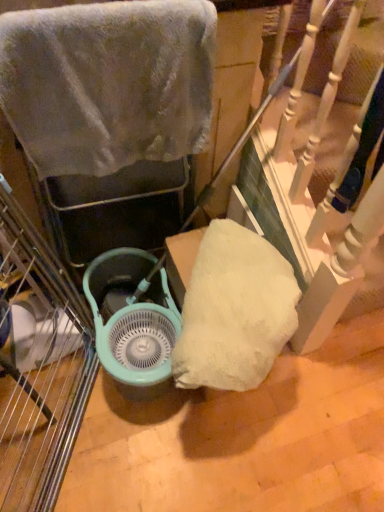
I want to click on vacant area on top of fuzzy gray towel at upper left (from a real-world perspective), so click(84, 8).